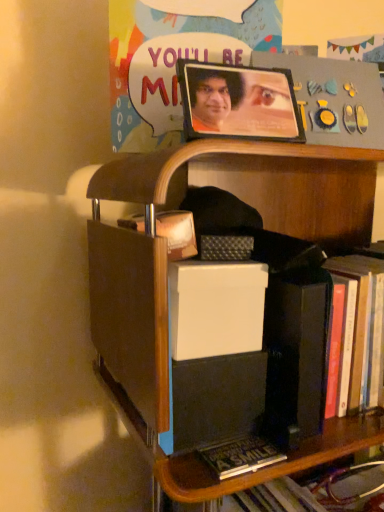
Question: From the image's perspective, is matte plastic poster at upper center over wooden shelf at center?

Choices:
 (A) no
 (B) yes

Answer: (B)

Question: Is matte plastic poster at upper center next to wooden shelf at center?

Choices:
 (A) no
 (B) yes

Answer: (A)

Question: Can you confirm if matte plastic poster at upper center is thinner than wooden shelf at center?

Choices:
 (A) yes
 (B) no

Answer: (A)

Question: Does matte plastic poster at upper center appear on the left side of wooden shelf at center?

Choices:
 (A) no
 (B) yes

Answer: (B)

Question: Is matte plastic poster at upper center positioned before wooden shelf at center?

Choices:
 (A) no
 (B) yes

Answer: (A)

Question: Is wooden shelf at center inside the boundaries of matte plastic poster at upper center, or outside?

Choices:
 (A) outside
 (B) inside

Answer: (A)

Question: From their relative heights in the image, would you say wooden shelf at center is taller or shorter than matte plastic poster at upper center?

Choices:
 (A) tall
 (B) short

Answer: (A)

Question: Visually, is wooden shelf at center positioned to the left or to the right of matte plastic poster at upper center?

Choices:
 (A) left
 (B) right

Answer: (B)

Question: From the image's perspective, is wooden shelf at center above or below matte plastic poster at upper center?

Choices:
 (A) above
 (B) below

Answer: (B)

Question: Does point click(271, 5) appear closer or farther from the camera than point click(165, 413)?

Choices:
 (A) closer
 (B) farther

Answer: (B)

Question: In terms of size, does matte plastic poster at upper center appear bigger or smaller than wooden shelf at center?

Choices:
 (A) small
 (B) big

Answer: (A)

Question: Considering their positions, is matte plastic poster at upper center located in front of or behind wooden shelf at center?

Choices:
 (A) front
 (B) behind

Answer: (B)

Question: From the image's perspective, is matte plastic poster at upper center located above or below wooden shelf at center?

Choices:
 (A) above
 (B) below

Answer: (A)

Question: Is wooden picture frame at upper center bigger or smaller than wooden shelf at center?

Choices:
 (A) small
 (B) big

Answer: (A)

Question: In terms of width, does wooden picture frame at upper center look wider or thinner when compared to wooden shelf at center?

Choices:
 (A) wide
 (B) thin

Answer: (B)